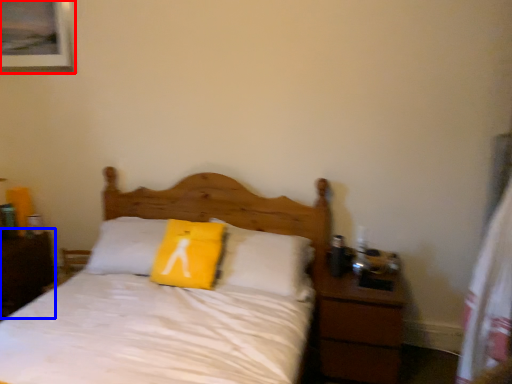
Question: Which object appears farthest to the camera in this image, picture frame (highlighted by a red box) or nightstand (highlighted by a blue box)?

Choices:
 (A) picture frame
 (B) nightstand

Answer: (A)